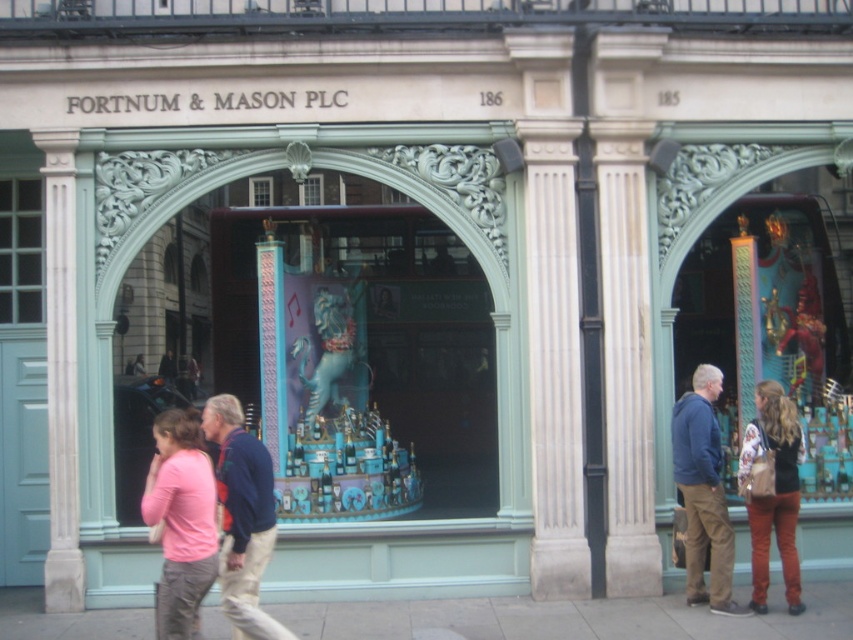
Identify the location of pink fabric shirt at lower left. The image size is (853, 640). (181, 520).

Which is behind, point (202, 438) or point (691, 586)?

The point (691, 586) is more distant.

Find the location of a particular element. The height and width of the screenshot is (640, 853). pink fabric shirt at lower left is located at coordinates (181, 520).

Is the position of smooth concrete sidewalk at lower center more distant than that of blue fleece jacket at center?

That is False.

Is point (102, 628) farther from camera compared to point (691, 600)?

No, (102, 628) is in front of (691, 600).

Who is more forward, (668, 628) or (691, 406)?

Positioned in front is point (668, 628).

The image size is (853, 640). In order to click on smooth concrete sidewalk at lower center in this screenshot , I will do `click(567, 618)`.

Can you confirm if shiny blue statue at center is thinner than blue cotton jacket at center?

Incorrect, shiny blue statue at center's width is not less than blue cotton jacket at center's.

Is shiny blue statue at center taller than blue cotton jacket at center?

Correct, shiny blue statue at center is much taller as blue cotton jacket at center.

Who is more forward, (445, 250) or (239, 474)?

Positioned in front is point (239, 474).

Image resolution: width=853 pixels, height=640 pixels. Find the location of `shiny blue statue at center`. shiny blue statue at center is located at coordinates (368, 337).